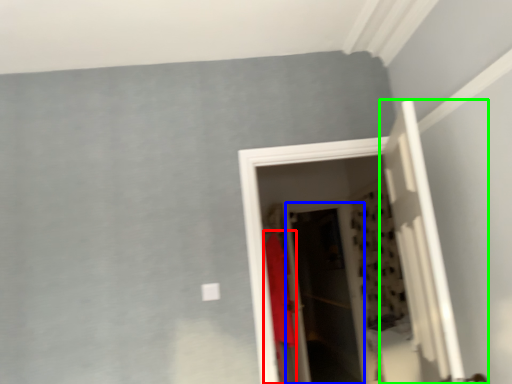
Question: Based on their relative distances, which object is farther from clothing (highlighted by a red box)? Choose from screen door (highlighted by a blue box) and door (highlighted by a green box).

Choices:
 (A) screen door
 (B) door

Answer: (B)